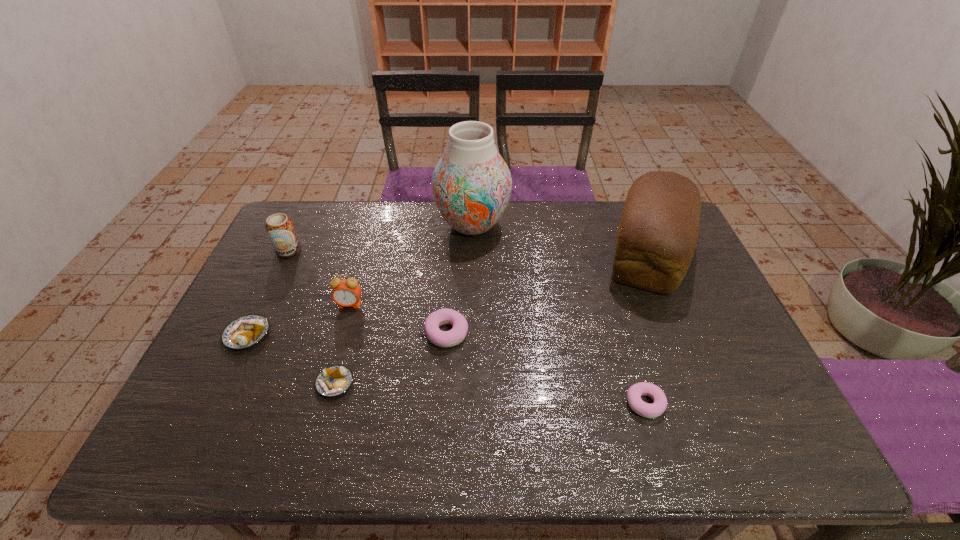
Image resolution: width=960 pixels, height=540 pixels. Find the location of `vase`. vase is located at coordinates (471, 184).

You are a GUI agent. You are given a task and a screenshot of the screen. Output one action in this format:
    pyautogui.click(x=<x>, y=<y>)
    Task: Click on the brown bread
    This screenshot has width=960, height=540.
    Given the screenshot: What is the action you would take?
    pyautogui.click(x=657, y=235)

Image resolution: width=960 pixels, height=540 pixels. I want to click on the second tallest object, so click(x=657, y=235).

This screenshot has width=960, height=540. In order to click on beer can in this screenshot , I will do `click(279, 227)`.

Where is `pink alarm clock`? The height and width of the screenshot is (540, 960). pink alarm clock is located at coordinates (347, 293).

Find the location of a particular element. the bigger pink pastry is located at coordinates (457, 334).

You are a GUI agent. You are given a task and a screenshot of the screen. Output one action in this format:
    pyautogui.click(x=<x>, y=<y>)
    Task: Click on the third pastry from left to right
    The image size is (960, 540).
    Given the screenshot: What is the action you would take?
    pyautogui.click(x=457, y=334)

I want to click on the leftmost pastry, so click(246, 331).

At what (x,y) coordinates should I click in order to perform the action: click on the left brown pastry. Please return your answer as a coordinate pair (x, y). This screenshot has width=960, height=540. Looking at the image, I should click on (246, 331).

This screenshot has height=540, width=960. I want to click on the right pink pastry, so click(634, 393).